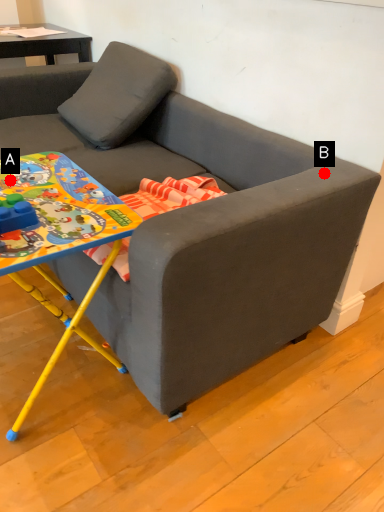
Question: Two points are circled on the image, labeled by A and B beside each circle. Among these points, which one is farthest from the camera?

Choices:
 (A) A is further
 (B) B is further

Answer: (A)